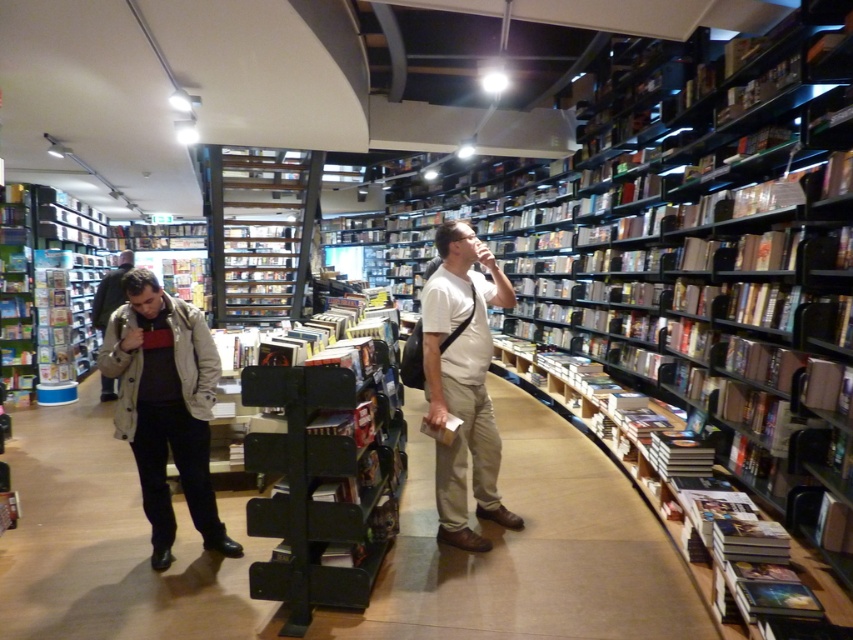
Question: Can you confirm if light beige cotton jacket at center is smaller than light brown leather jacket at left?

Choices:
 (A) yes
 (B) no

Answer: (B)

Question: Does metallic silver shelves at center appear over light brown leather jacket at left?

Choices:
 (A) no
 (B) yes

Answer: (B)

Question: Which point is closer to the camera?

Choices:
 (A) (218, 227)
 (B) (97, 323)
 (C) (434, 385)

Answer: (C)

Question: Does white matte shirt at center come in front of light beige cotton jacket at center?

Choices:
 (A) no
 (B) yes

Answer: (A)

Question: Which of these objects is positioned farthest from the light beige cotton jacket at center?

Choices:
 (A) metallic silver shelves at center
 (B) light brown leather jacket at left

Answer: (B)

Question: Among these points, which one is nearest to the camera?

Choices:
 (A) coord(445,294)
 (B) coord(250,220)
 (C) coord(471,317)

Answer: (A)